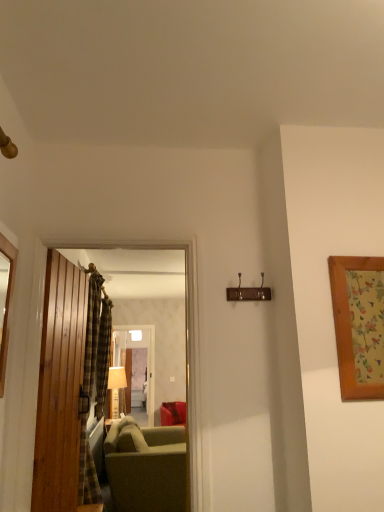
Question: Is plaid fabric curtain at left, which appears as the 1th curtain when viewed from the back, thinner than wooden mirror at left, marked as the first picture frame in a left-to-right arrangement?

Choices:
 (A) no
 (B) yes

Answer: (A)

Question: From the image's perspective, is plaid fabric curtain at left, acting as the second curtain starting from the front, over wooden mirror at left, which ranks as the second picture frame in right-to-left order?

Choices:
 (A) yes
 (B) no

Answer: (B)

Question: Is plaid fabric curtain at left, arranged as the 2th curtain when viewed from the right, facing towards wooden mirror at left, marked as the first picture frame in a left-to-right arrangement?

Choices:
 (A) no
 (B) yes

Answer: (A)

Question: From a real-world perspective, is plaid fabric curtain at left, which appears as the 1th curtain when viewed from the back, under wooden mirror at left, which ranks as the second picture frame in right-to-left order?

Choices:
 (A) yes
 (B) no

Answer: (A)

Question: Is plaid fabric curtain at left, acting as the second curtain starting from the front, positioned before wooden mirror at left, marked as the first picture frame in a left-to-right arrangement?

Choices:
 (A) no
 (B) yes

Answer: (A)

Question: Looking at their shapes, would you say wooden picture frame at right, arranged as the 1th picture frame when viewed from the right, is wider or thinner than plaid fabric curtain at left, which appears as the second curtain when viewed from the back?

Choices:
 (A) wide
 (B) thin

Answer: (B)

Question: From the image's perspective, is wooden picture frame at right, which is the second picture frame from left to right, positioned above or below plaid fabric curtain at left, the second curtain in the left-to-right sequence?

Choices:
 (A) above
 (B) below

Answer: (A)

Question: Would you say wooden picture frame at right, arranged as the 1th picture frame when viewed from the right, is inside or outside plaid fabric curtain at left, the 1th curtain when ordered from right to left?

Choices:
 (A) outside
 (B) inside

Answer: (A)

Question: From a real-world perspective, is wooden picture frame at right, which is the second picture frame from left to right, physically located above or below plaid fabric curtain at left, which ranks as the 1th curtain in front-to-back order?

Choices:
 (A) below
 (B) above

Answer: (B)

Question: Considering the positions of point (180, 410) and point (1, 254), is point (180, 410) closer or farther from the camera than point (1, 254)?

Choices:
 (A) closer
 (B) farther

Answer: (B)

Question: Based on their sizes in the image, would you say wooden door at center, the first door from the right, is bigger or smaller than wooden mirror at left, which ranks as the second picture frame in right-to-left order?

Choices:
 (A) big
 (B) small

Answer: (A)

Question: From a real-world perspective, is wooden door at center, the first door from the right, physically located above or below wooden mirror at left, which ranks as the second picture frame in right-to-left order?

Choices:
 (A) above
 (B) below

Answer: (B)

Question: Is wooden door at center, which is the 2th door from left to right, taller or shorter than wooden mirror at left, which ranks as the second picture frame in right-to-left order?

Choices:
 (A) tall
 (B) short

Answer: (A)

Question: Which is correct: plaid fabric curtain at left, the second curtain in the left-to-right sequence, is inside wooden picture frame at right, arranged as the 1th picture frame when viewed from the right, or outside of it?

Choices:
 (A) outside
 (B) inside

Answer: (A)

Question: From the image's perspective, is plaid fabric curtain at left, which ranks as the 1th curtain in front-to-back order, above or below wooden picture frame at right, which is the second picture frame from left to right?

Choices:
 (A) below
 (B) above

Answer: (A)